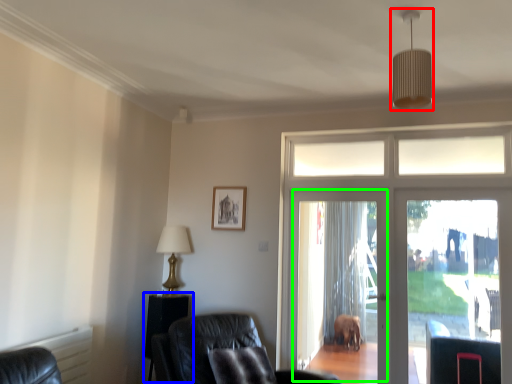
Question: Which is farther away from light fixture (highlighted by a red box)? side table (highlighted by a blue box) or screen door (highlighted by a green box)?

Choices:
 (A) side table
 (B) screen door

Answer: (A)